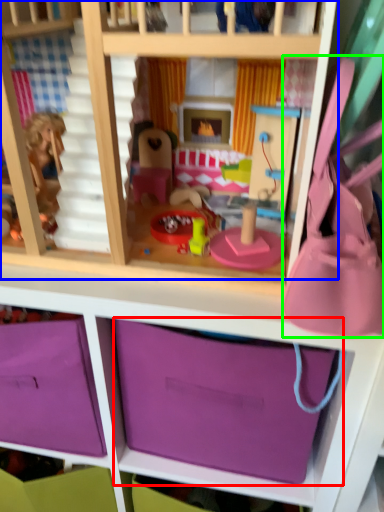
Question: Considering the real-world distances, which object is farthest from storage box (highlighted by a red box)? bunk bed (highlighted by a blue box) or accessory (highlighted by a green box)?

Choices:
 (A) bunk bed
 (B) accessory

Answer: (A)